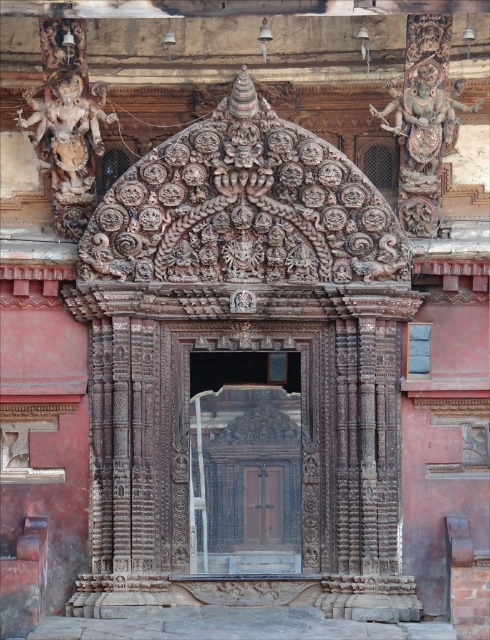
Question: Which point is closer to the camera?

Choices:
 (A) (220, 484)
 (B) (66, 120)
 (C) (433, 86)

Answer: (B)

Question: In this image, where is dark wood door at center located relative to carved stone statue at upper left?

Choices:
 (A) right
 (B) left

Answer: (A)

Question: Which of these objects is positioned farthest from the carved stone statue at upper left?

Choices:
 (A) carved wood deity at center
 (B) dark wood door at center

Answer: (B)

Question: Does dark wood door at center appear on the right side of carved wood deity at center?

Choices:
 (A) yes
 (B) no

Answer: (B)

Question: Can you confirm if carved wood deity at center is smaller than carved stone statue at upper left?

Choices:
 (A) no
 (B) yes

Answer: (A)

Question: Which of the following is the farthest from the observer?

Choices:
 (A) dark wood door at center
 (B) carved wood deity at center

Answer: (B)